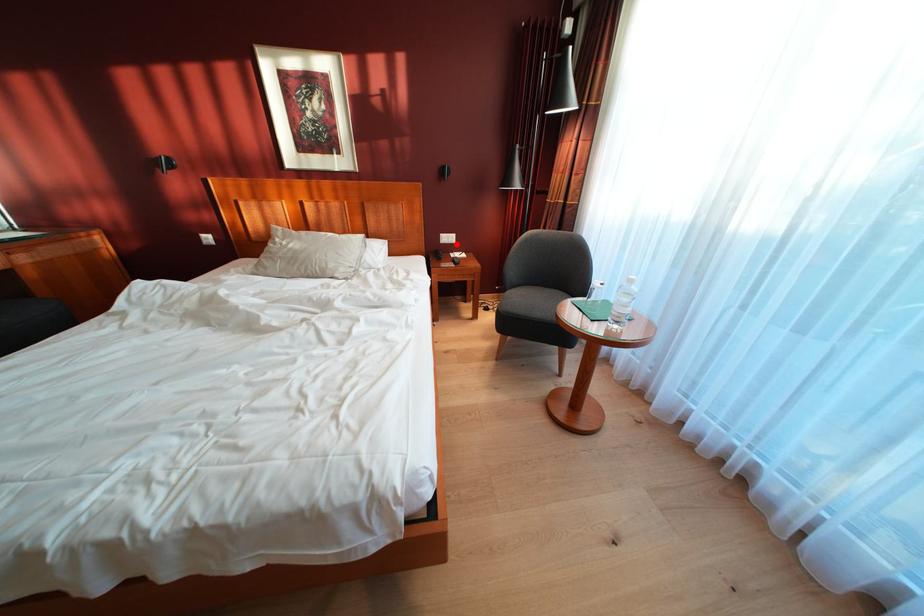
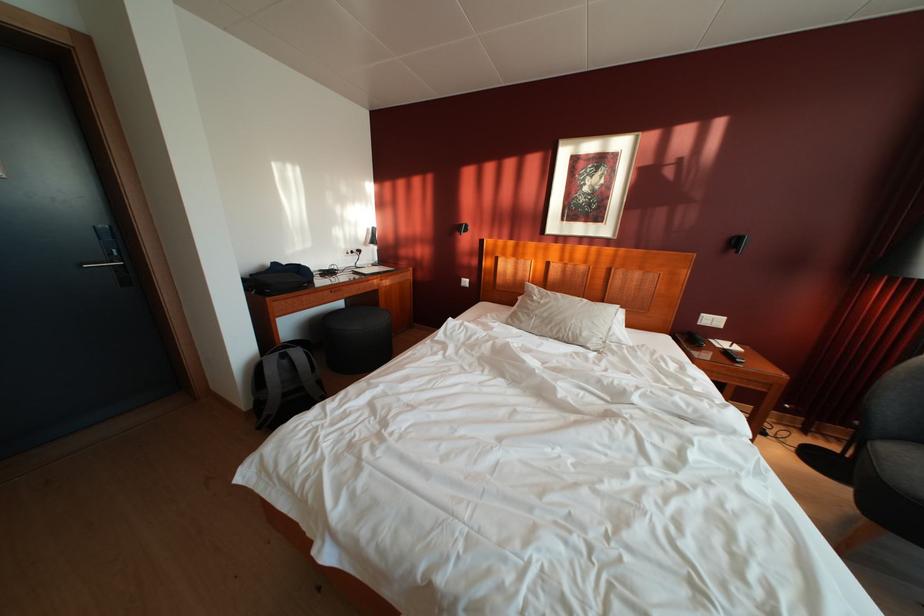
Where in the second image is the point corresponding to the highlighted location from the first image?

(721, 326)